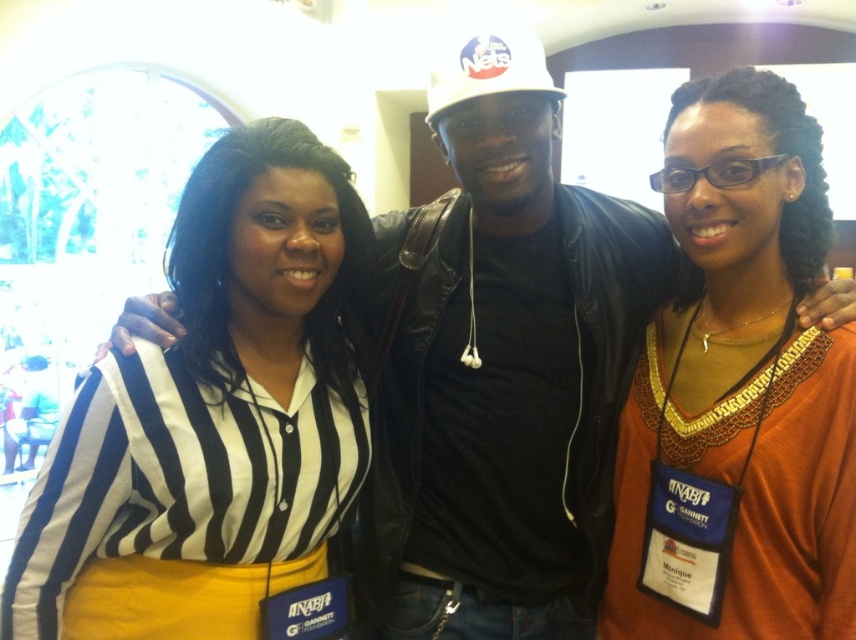
Question: Which point is farther to the camera?

Choices:
 (A) white matte baseball cap at center
 (B) orange fabric shirt at center

Answer: (A)

Question: Does orange fabric shirt at center appear on the left side of white matte baseball cap at center?

Choices:
 (A) no
 (B) yes

Answer: (A)

Question: Is striped fabric shirt at center to the right of orange fabric shirt at center from the viewer's perspective?

Choices:
 (A) yes
 (B) no

Answer: (B)

Question: Which is farther from the white matte baseball cap at center?

Choices:
 (A) orange fabric shirt at center
 (B) striped fabric shirt at center

Answer: (B)

Question: Which of the following is the closest to the observer?

Choices:
 (A) pos(528,51)
 (B) pos(639,448)

Answer: (A)

Question: Can you confirm if striped fabric shirt at center is smaller than white matte baseball cap at center?

Choices:
 (A) no
 (B) yes

Answer: (A)